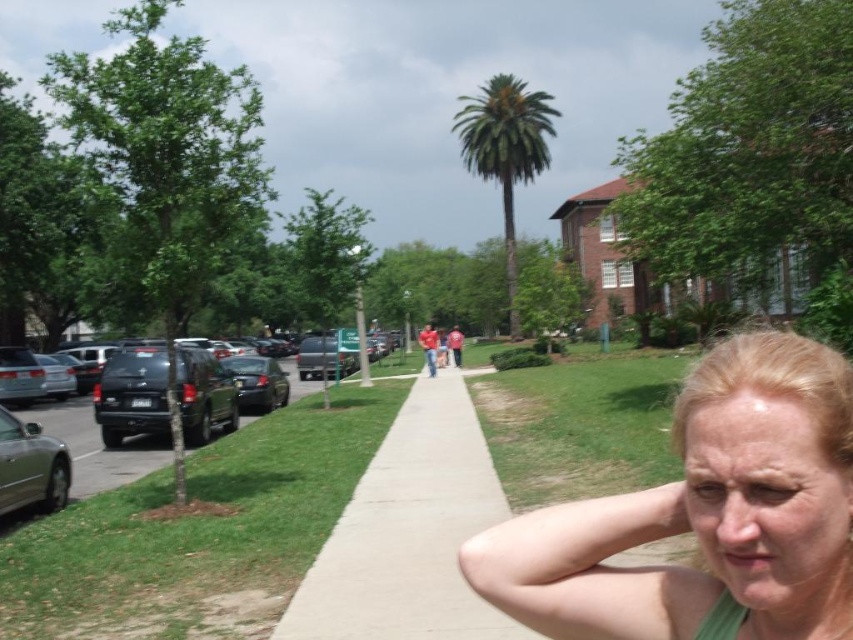
Question: Where is silver metallic car at left located in relation to glossy black car at left in the image?

Choices:
 (A) right
 (B) left

Answer: (A)

Question: Which of these objects is positioned closest to the pale skin face at lower right?

Choices:
 (A) black matte suv at left
 (B) matte black suv at left

Answer: (B)

Question: Which point is farther from the camera taking this photo?

Choices:
 (A) [416, 528]
 (B) [48, 413]

Answer: (B)

Question: Is green concrete sidewalk at center positioned before silver metallic car at left?

Choices:
 (A) yes
 (B) no

Answer: (A)

Question: Estimate the real-world distances between objects in this image. Which object is farther from the green concrete sidewalk at center?

Choices:
 (A) glossy black car at left
 (B) matte black suv at left
 (C) black matte suv at left
 (D) green matte tank top at center

Answer: (D)

Question: Is the position of pale skin face at lower right more distant than that of silver metallic car at left?

Choices:
 (A) no
 (B) yes

Answer: (A)